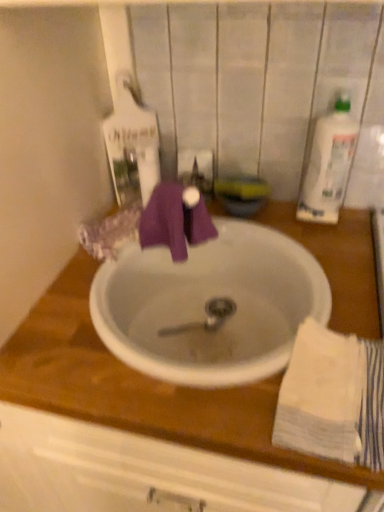
Question: Is white ceramic sink at center oriented away from white cotton towel at lower right?

Choices:
 (A) no
 (B) yes

Answer: (A)

Question: Is white ceramic sink at center not near white cotton towel at lower right?

Choices:
 (A) no
 (B) yes

Answer: (A)

Question: Is white ceramic sink at center not within white cotton towel at lower right?

Choices:
 (A) yes
 (B) no

Answer: (A)

Question: Is white ceramic sink at center smaller than white cotton towel at lower right?

Choices:
 (A) yes
 (B) no

Answer: (B)

Question: Would you say white ceramic sink at center contains white cotton towel at lower right?

Choices:
 (A) yes
 (B) no

Answer: (B)

Question: Considering the positions of white ceramic sink at center and white cotton towel at lower right in the image, is white ceramic sink at center taller or shorter than white cotton towel at lower right?

Choices:
 (A) tall
 (B) short

Answer: (A)

Question: Is white ceramic sink at center inside or outside of white cotton towel at lower right?

Choices:
 (A) outside
 (B) inside

Answer: (A)

Question: From a real-world perspective, relative to white cotton towel at lower right, is white ceramic sink at center vertically above or below?

Choices:
 (A) above
 (B) below

Answer: (B)

Question: Does point [271, 342] appear closer or farther from the camera than point [327, 453]?

Choices:
 (A) farther
 (B) closer

Answer: (A)

Question: In the image, is white cotton towel at lower right on the left side or the right side of white ceramic sink at center?

Choices:
 (A) left
 (B) right

Answer: (B)

Question: In terms of width, does white cotton towel at lower right look wider or thinner when compared to white ceramic sink at center?

Choices:
 (A) thin
 (B) wide

Answer: (A)

Question: From a real-world perspective, relative to white ceramic sink at center, is white cotton towel at lower right vertically above or below?

Choices:
 (A) below
 (B) above

Answer: (B)

Question: Considering their positions, is white cotton towel at lower right located in front of or behind white ceramic sink at center?

Choices:
 (A) front
 (B) behind

Answer: (A)

Question: Looking at their shapes, would you say white ceramic sink at center is wider or thinner than white plastic bottle at upper right?

Choices:
 (A) thin
 (B) wide

Answer: (B)

Question: Is point (175, 311) closer or farther from the camera than point (301, 205)?

Choices:
 (A) farther
 (B) closer

Answer: (B)